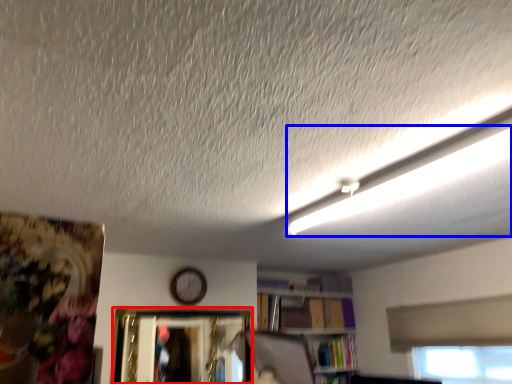
Question: Among these objects, which one is nearest to the camera, picture frame (highlighted by a red box) or lighting (highlighted by a blue box)?

Choices:
 (A) picture frame
 (B) lighting

Answer: (B)